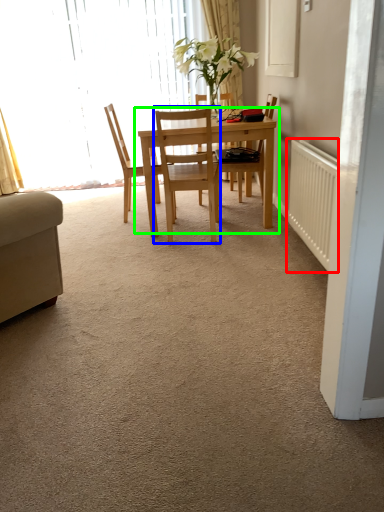
Question: Based on their relative distances, which object is nearer to radiator (highlighted by a red box)? Choose from chair (highlighted by a blue box) and kitchen & dining room table (highlighted by a green box).

Choices:
 (A) chair
 (B) kitchen & dining room table

Answer: (B)